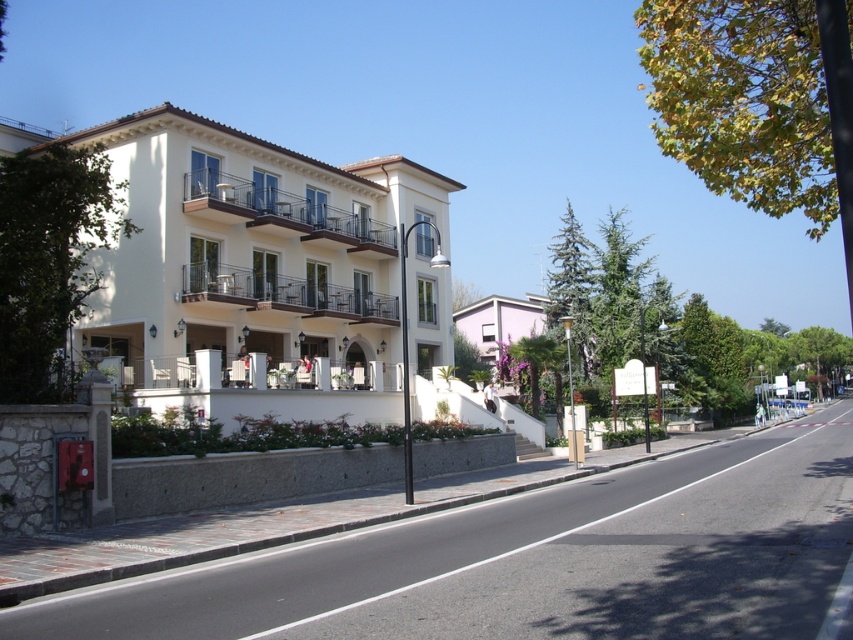
Looking at this image, who is positioned more to the right, green leafy tree at upper right or green leafy tree at upper center?

green leafy tree at upper right

What do you see at coordinates (744, 100) in the screenshot?
I see `green leafy tree at upper right` at bounding box center [744, 100].

This screenshot has width=853, height=640. I want to click on green leafy tree at upper right, so click(x=744, y=100).

Which of these two, green leafy tree at upper right or green leafy tree at left, stands taller?

Standing taller between the two is green leafy tree at upper right.

Is green leafy tree at upper right to the right of green leafy tree at left from the viewer's perspective?

Indeed, green leafy tree at upper right is positioned on the right side of green leafy tree at left.

Is point (724, 22) positioned in front of point (9, 381)?

No.

Find the location of a particular element. The width and height of the screenshot is (853, 640). green leafy tree at upper right is located at coordinates (744, 100).

Is green leafy tree at upper right above purple matte building at center?

Yes, green leafy tree at upper right is above purple matte building at center.

Is point (804, 67) closer to camera compared to point (515, 323)?

Yes, point (804, 67) is in front of point (515, 323).

In order to click on green leafy tree at upper right in this screenshot , I will do `click(744, 100)`.